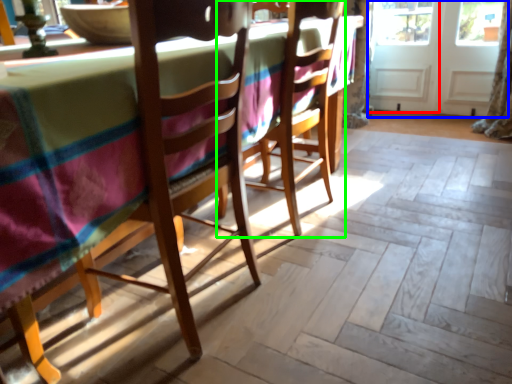
Question: Which is nearer to the screen door (highlighted by a red box)? screen door (highlighted by a blue box) or chair (highlighted by a green box).

Choices:
 (A) screen door
 (B) chair

Answer: (A)